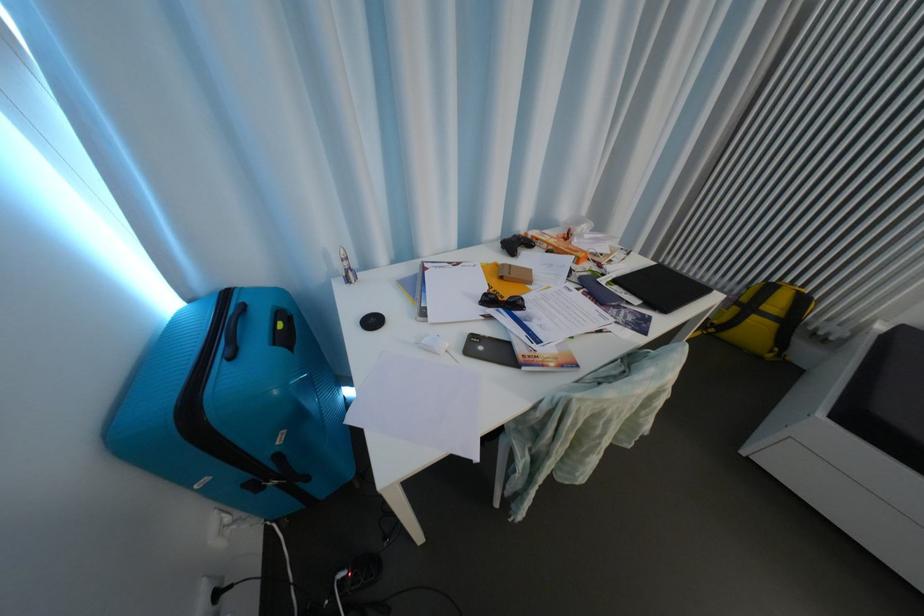
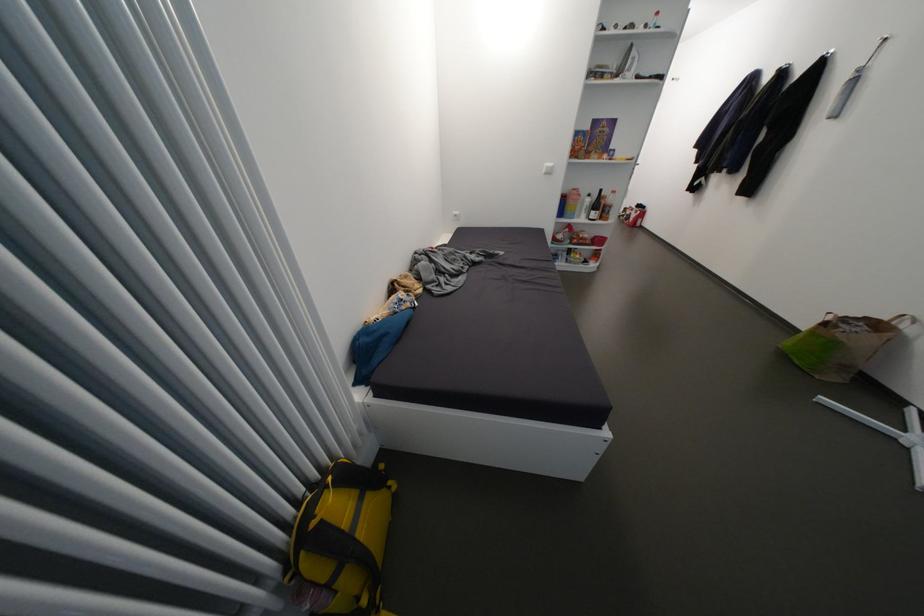
Find the pixel in the second image that matches point 761,320 in the first image.

(370, 533)